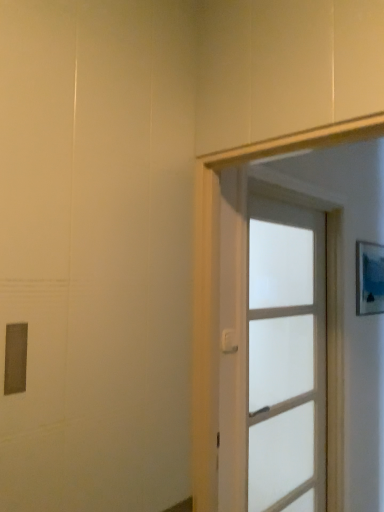
What do you see at coordinates (271, 349) in the screenshot?
I see `white frosted glass door at center` at bounding box center [271, 349].

Locate an element on the screen. white frosted glass door at center is located at coordinates (271, 349).

At what (x,y) coordinates should I click in order to perform the action: click on white frosted glass door at center. Please return your answer as a coordinate pair (x, y). The height and width of the screenshot is (512, 384). Looking at the image, I should click on (271, 349).